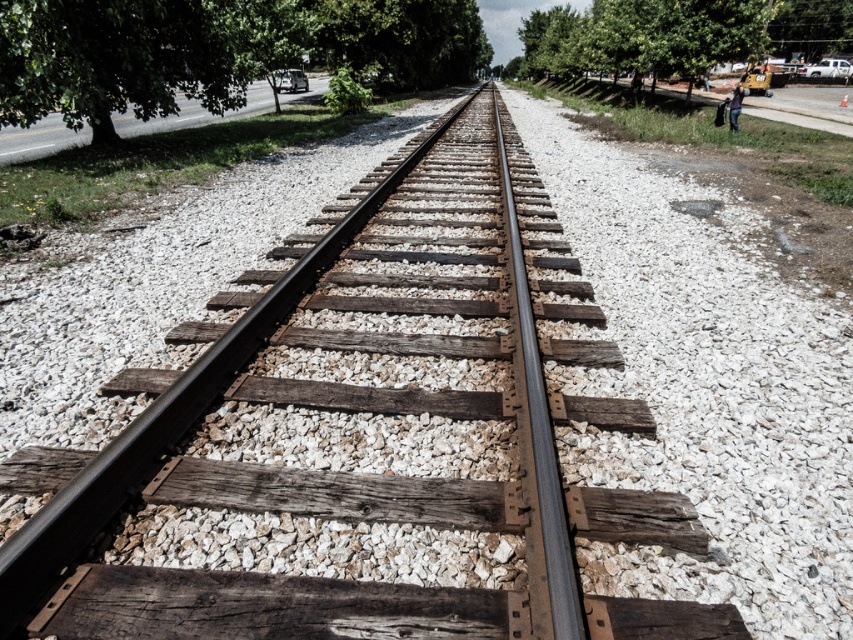
You are standing at the starting point of the railway track and see the green leafy tree at upper left and the green leafy tree at upper right. Which tree is nearer to you?

The green leafy tree at upper left is closer to the viewer than the green leafy tree at upper right, so the green leafy tree at upper left is nearer to you.

You are standing at the center of the railway track and see the green leafy tree at upper left and the green leafy tree at upper right. Which tree is positioned to the left when viewed from your perspective?

The green leafy tree at upper left is positioned to the left of the green leafy tree at upper right from your perspective.